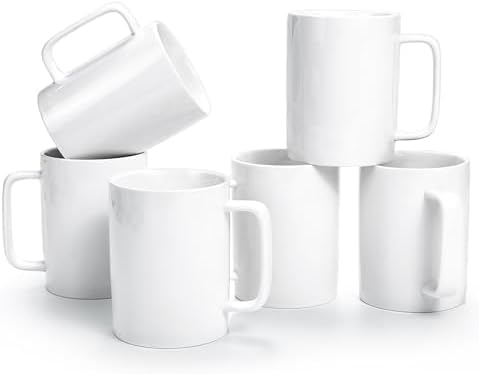
In order to click on white mug in this screenshot , I will do `click(346, 108)`, `click(145, 95)`, `click(65, 208)`, `click(156, 245)`, `click(299, 200)`, `click(432, 209)`.